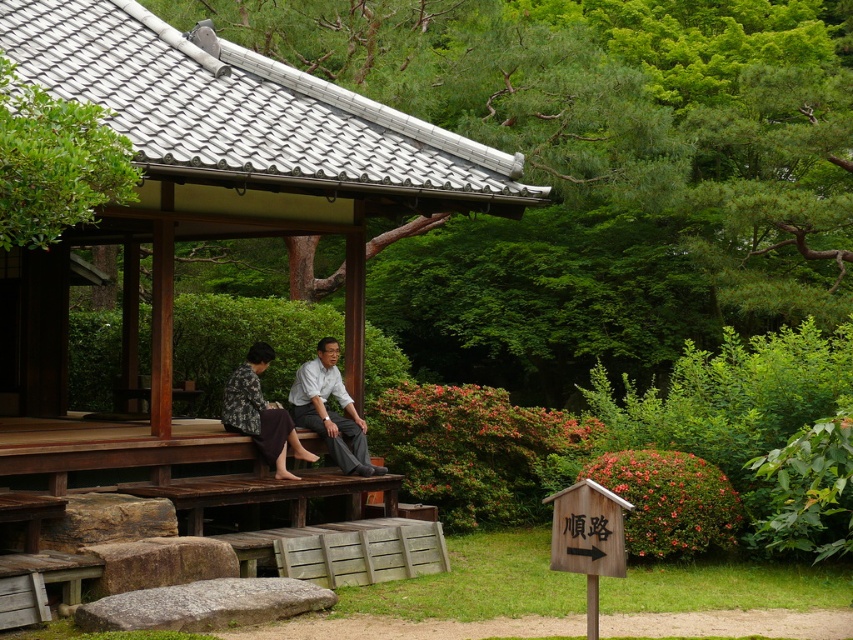
You are a tour guide leading a group to the wooden gazebo at center. A tourist asks if they can reach the gazebo from their current position near the matte gray pants at center within 10 feet. What do you tell them?

The distance between the wooden gazebo at center and the matte gray pants at center is 9.75 feet, so yes, the tourist can reach the gazebo within 10 feet from their current position near the matte gray pants at center.

You are a visitor at the park and want to take a photo of the wooden gazebo at center and the matte gray pants at center. Which object should you focus on first if you want to capture both in the same frame without moving the camera?

The wooden gazebo at center has a lesser height compared to matte gray pants at center, so you should focus on the matte gray pants at center first to ensure both are in the frame.

You are standing in the garden and want to walk from the wooden gazebo at center to the matte gray pants at center. Which direction should you move to get there?

Since the wooden gazebo at center is positioned on the left side of matte gray pants at center, you should move to the right to reach the matte gray pants at center from the wooden gazebo at center.